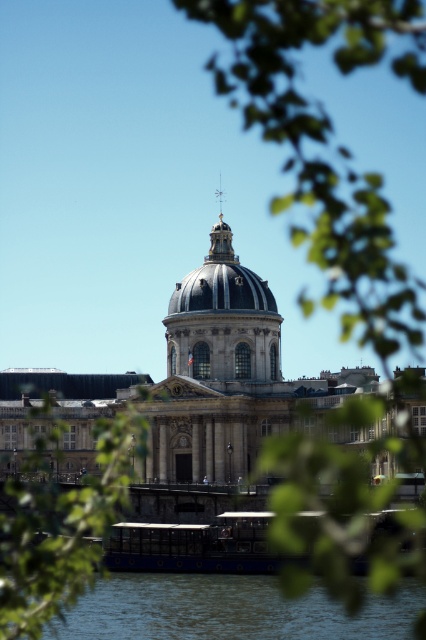
You are standing on the ground floor of the building and looking towards the stone dome at center. There is blue water at lower center in front of you. Which object is closer to you?

The blue water at lower center is closer to you than the stone dome at center.

You are standing in front of the grand building with its central dome and classical columns. You notice two points marked on the facade at coordinates point (x=187, y=381) and point (x=108, y=621). Which of these points is closer to you, the observer?

Point (x=108, y=621) is closer to the observer because the description states that point (x=187, y=381) is further to the camera than point (x=108, y=621).

You are an architect evaluating the proportions of the building. Based on the image, which object has a greater height between the stone dome at center and the blue water at lower center?

The stone dome at center has a greater height compared to the blue water at lower center.